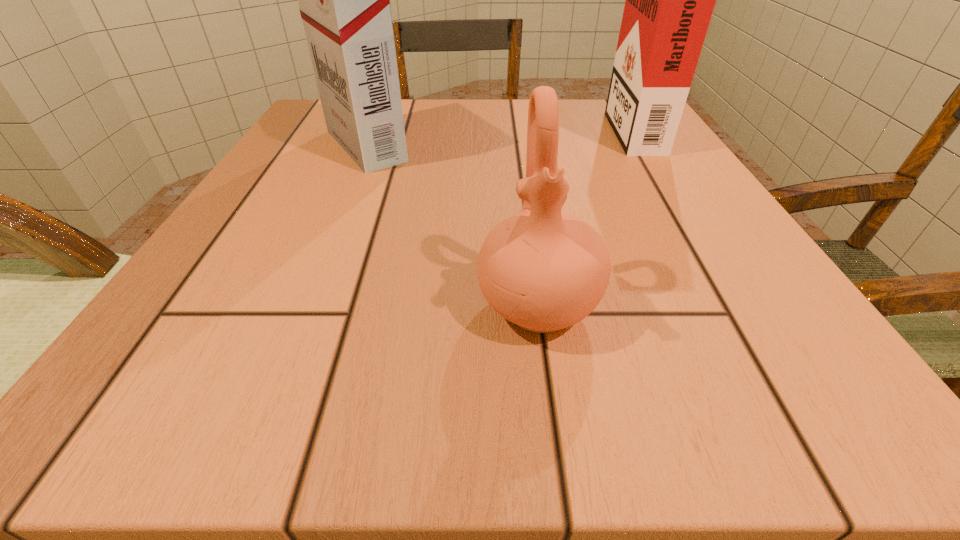
I want to click on the leftmost object, so click(x=344, y=0).

I want to click on the right cigarette case, so click(x=669, y=2).

The image size is (960, 540). I want to click on the shorter cigarette case, so click(x=669, y=2).

Locate an element on the screen. the nearest object is located at coordinates (543, 270).

You are a GUI agent. You are given a task and a screenshot of the screen. Output one action in this format:
    pyautogui.click(x=<x>, y=<y>)
    Task: Click on the second object from right to left
    This screenshot has width=960, height=540.
    Given the screenshot: What is the action you would take?
    pyautogui.click(x=543, y=270)

The width and height of the screenshot is (960, 540). In order to click on free region located 0.080m on the right of the left cigarette case in this screenshot , I will do `click(454, 146)`.

Locate an element on the screen. The image size is (960, 540). free space located 0.380m on the front-facing side of the right cigarette case is located at coordinates (425, 128).

Identify the location of vacant region located on the front-facing side of the right cigarette case. The image size is (960, 540). (425, 128).

Where is `free point located on the front-facing side of the right cigarette case`? The width and height of the screenshot is (960, 540). free point located on the front-facing side of the right cigarette case is located at coordinates (416, 128).

Image resolution: width=960 pixels, height=540 pixels. I want to click on free spot located 0.080m on the spout of the nearest object, so click(x=554, y=422).